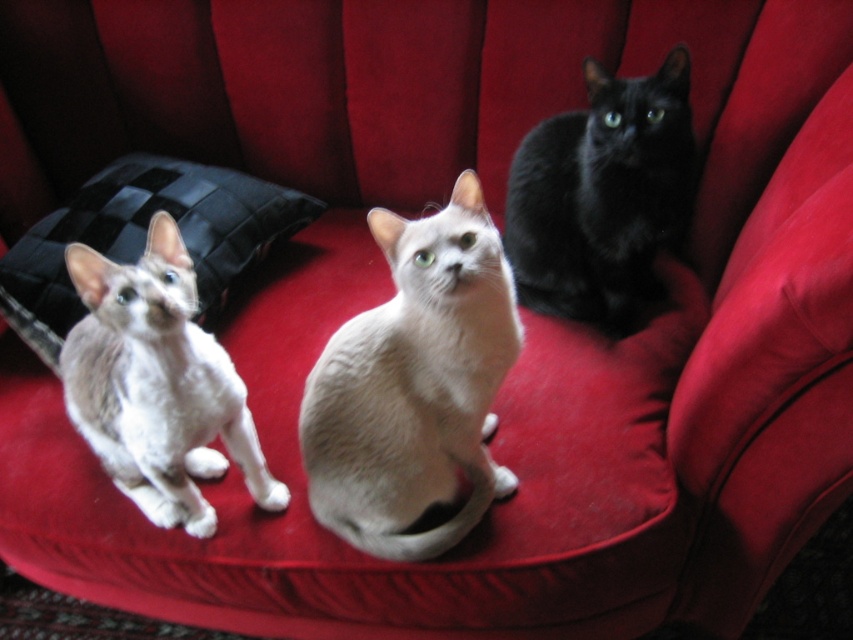
You are a photographer trying to capture a closeup of the cats on the red couch. You want to focus on the white matte cat at center and the black silky cat at upper right. Which cat will appear larger in your photo?

The white matte cat at center will appear larger in the photo because it is closer to the viewer than the black silky cat at upper right.